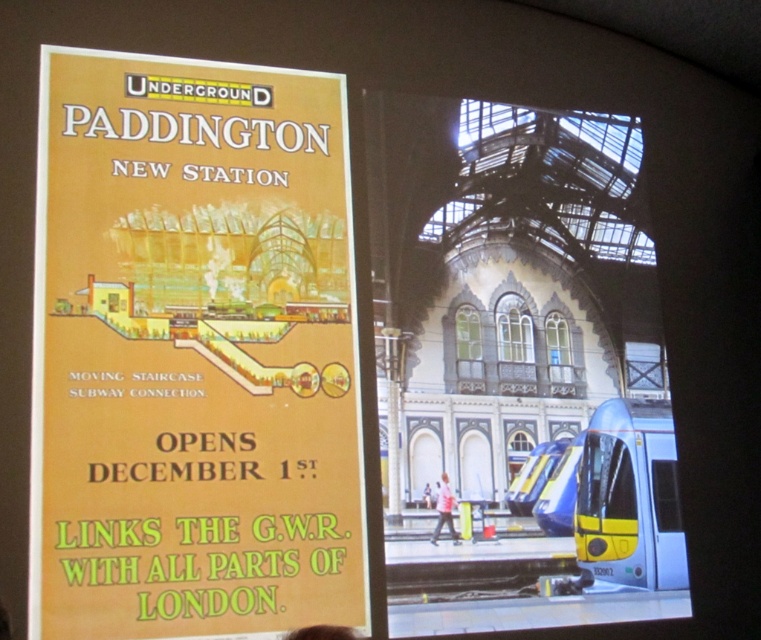
You are an art curator planning to display both the matte yellow poster at upper left and the brown hair at upper center in an exhibition. If you want to arrange them side by side on a wall, which object should you place first to ensure they fit without overlapping?

The matte yellow poster at upper left might be wider than brown hair at upper center, so you should place the matte yellow poster at upper left first to accommodate its potential width.

You are standing at the vintage poster on the left side of the image. You want to walk straight towards the blue train at center. Will you pass through the point at coordinate (502, 349)?

The point at coordinate (502, 349) is on the blue train at center. Since you are walking straight towards the blue train at center, you will pass through the point at coordinate (502, 349).